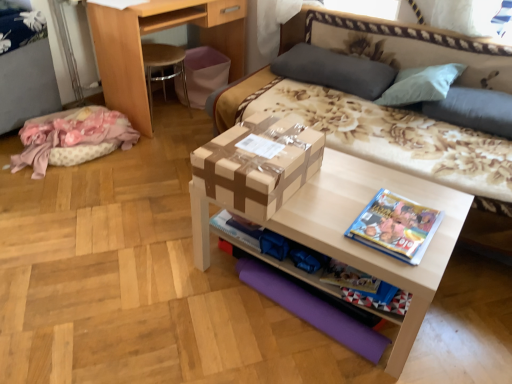
Question: Can you confirm if gray fabric pillow at upper right, the first pillow from the right, is taller than light brown wood desk at upper left?

Choices:
 (A) yes
 (B) no

Answer: (B)

Question: Is gray fabric pillow at upper right, the first pillow from the right, far from light brown wood desk at upper left?

Choices:
 (A) no
 (B) yes

Answer: (B)

Question: From a real-world perspective, does gray fabric pillow at upper right, the first pillow from the right, stand above light brown wood desk at upper left?

Choices:
 (A) no
 (B) yes

Answer: (B)

Question: Is gray fabric pillow at upper right, the first pillow from the right, positioned before light brown wood desk at upper left?

Choices:
 (A) no
 (B) yes

Answer: (B)

Question: From the image's perspective, does gray fabric pillow at upper right, which is the 2th pillow from left to right, appear lower than light brown wood desk at upper left?

Choices:
 (A) no
 (B) yes

Answer: (B)

Question: Considering the relative sizes of gray fabric pillow at upper right, which is the 2th pillow from left to right, and light brown wood desk at upper left in the image provided, is gray fabric pillow at upper right, which is the 2th pillow from left to right, thinner than light brown wood desk at upper left?

Choices:
 (A) no
 (B) yes

Answer: (B)

Question: Does light brown wood desk at upper left appear on the left side of blue glossy book at right?

Choices:
 (A) yes
 (B) no

Answer: (A)

Question: Is light brown wood desk at upper left oriented away from blue glossy book at right?

Choices:
 (A) yes
 (B) no

Answer: (B)

Question: Can you confirm if light brown wood desk at upper left is shorter than blue glossy book at right?

Choices:
 (A) yes
 (B) no

Answer: (B)

Question: Is light brown wood desk at upper left wider than blue glossy book at right?

Choices:
 (A) no
 (B) yes

Answer: (B)

Question: Does light brown wood desk at upper left touch blue glossy book at right?

Choices:
 (A) yes
 (B) no

Answer: (B)

Question: Is light brown wood desk at upper left facing towards blue glossy book at right?

Choices:
 (A) no
 (B) yes

Answer: (B)

Question: Can you confirm if gray fabric pillow at upper center, which is the 1th pillow from left to right, is thinner than matte cardboard box at center?

Choices:
 (A) yes
 (B) no

Answer: (A)